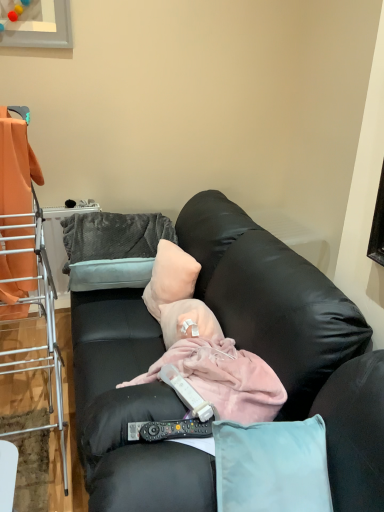
Question: In the image, is orange fabric at left on the left side or the right side of black plastic remote control at lower center, positioned as the 2th remote control in top-to-bottom order?

Choices:
 (A) left
 (B) right

Answer: (A)

Question: Is orange fabric at left taller or shorter than black plastic remote control at lower center, which is the first remote control from bottom to top?

Choices:
 (A) short
 (B) tall

Answer: (B)

Question: Which object is positioned farthest from the black leather couch at center?

Choices:
 (A) pale pink fabric pillow at center, acting as the 2th pillow starting from the left
 (B) orange fabric at left
 (C) black plastic remote control at lower center, positioned as the 2th remote control in top-to-bottom order
 (D) orange fabric at left
 (E) black plastic remote control at center, the 1th remote control from the top

Answer: (B)

Question: Estimate the real-world distances between objects in this image. Which object is closer to the black plastic remote control at center, the 1th remote control from the top?

Choices:
 (A) pale pink fabric pillow at center, the 1th pillow from the right
 (B) black leather couch at center
 (C) orange fabric at left
 (D) black plastic remote control at lower center, which is the first remote control from bottom to top
 (E) orange fabric at left

Answer: (D)